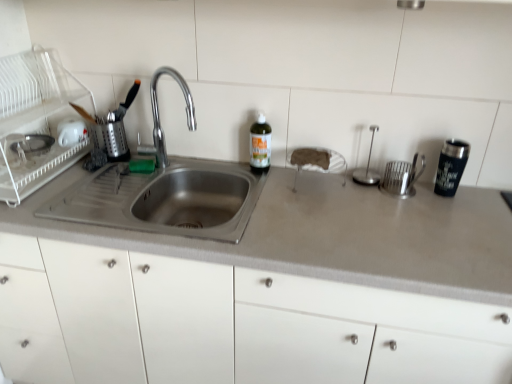
Measure the distance between point (340,169) and camera.

Point (340,169) and camera are 1.53 meters apart.

This screenshot has width=512, height=384. In order to click on white matte sponge at center, which is counted as the third appliance, starting from the left in this screenshot , I will do `click(317, 162)`.

Where is `green glass bottle at center`? green glass bottle at center is located at coordinates (260, 144).

At what (x,y) coordinates should I click in order to perform the action: click on polished stainless steel spoon holder at right, which is counted as the 4th appliance, starting from the left. Please return your answer as a coordinate pair (x, y). Looking at the image, I should click on (367, 166).

Locate an element on the screen. white matte sponge at center, which appears as the 3th appliance when viewed from the right is located at coordinates (317, 162).

From the image's perspective, is stainless steel sink at left located above or below polished stainless steel spoon holder at right, positioned as the second appliance in right-to-left order?

stainless steel sink at left is below polished stainless steel spoon holder at right, positioned as the second appliance in right-to-left order.

Find the location of a particular element. sink that appears below the polished stainless steel spoon holder at right, positioned as the second appliance in right-to-left order (from a real-world perspective) is located at coordinates (165, 191).

Would you say polished stainless steel spoon holder at right, positioned as the second appliance in right-to-left order, is part of stainless steel sink at left's contents?

No, stainless steel sink at left does not contain polished stainless steel spoon holder at right, positioned as the second appliance in right-to-left order.

Which is behind, stainless steel sink at left or polished stainless steel spoon holder at right, which is counted as the 4th appliance, starting from the left?

polished stainless steel spoon holder at right, which is counted as the 4th appliance, starting from the left, is further from the camera.

Based on the photo, considering the positions of objects green glass bottle at center and white glossy mug at upper left, placed as the 4th appliance when sorted from right to left, in the image provided, who is behind, green glass bottle at center or white glossy mug at upper left, placed as the 4th appliance when sorted from right to left,?

Positioned behind is white glossy mug at upper left, placed as the 4th appliance when sorted from right to left.

Is point (263, 154) positioned in front of point (80, 138)?

Yes, point (263, 154) is closer to viewer.

Consider the image. Is green glass bottle at center turned away from white glossy mug at upper left, the 2th appliance viewed from the left?

No, green glass bottle at center is not facing the opposite direction of white glossy mug at upper left, the 2th appliance viewed from the left.

From the image's perspective, which is above, green glass bottle at center or white glossy mug at upper left, the 2th appliance viewed from the left?

From the image's view, white glossy mug at upper left, the 2th appliance viewed from the left, is above.

The height and width of the screenshot is (384, 512). I want to click on bottle above the stainless steel sink at left (from a real-world perspective), so click(x=260, y=144).

What's the angular difference between green glass bottle at center and stainless steel sink at left's facing directions?

They differ by 0.0365 degrees in their facing directions.

Considering the points (259, 167) and (197, 225), which point is behind, point (259, 167) or point (197, 225)?

Positioned behind is point (197, 225).

Does gray matte countertop at center have a greater width compared to stainless steel sink at left?

Indeed, gray matte countertop at center has a greater width compared to stainless steel sink at left.

Is stainless steel sink at left inside gray matte countertop at center?

Yes, stainless steel sink at left can be found within gray matte countertop at center.

How far apart are gray matte countertop at center and stainless steel sink at left?

They are 9.86 inches apart.

From a real-world perspective, which object stands above the other?

white plastic dish rack at left, positioned as the 5th appliance in right-to-left order, is physically above.

Which of these two, white plastic dish rack at left, positioned as the 5th appliance in right-to-left order, or green glass bottle at center, is bigger?

Bigger between the two is white plastic dish rack at left, positioned as the 5th appliance in right-to-left order.

Looking at this image, measure the distance from white plastic dish rack at left, the 1th appliance from the left, to green glass bottle at center.

A distance of 29.61 inches exists between white plastic dish rack at left, the 1th appliance from the left, and green glass bottle at center.

In order to click on appliance that is the 2nd one above the green glass bottle at center (from a real-world perspective) in this screenshot , I will do `click(35, 121)`.

In order to click on tableware above the gray matte countertop at center (from a real-world perspective) in this screenshot , I will do `click(451, 167)`.

From a real-world perspective, is gray matte countertop at center on top of black stainless steel tumbler at right?

No.

What's the angular difference between gray matte countertop at center and black stainless steel tumbler at right's facing directions?

1.07 degrees separate the facing orientations of gray matte countertop at center and black stainless steel tumbler at right.

Is gray matte countertop at center wider than black stainless steel tumbler at right?

Correct, the width of gray matte countertop at center exceeds that of black stainless steel tumbler at right.

Which is behind, point (196, 227) or point (445, 149)?

The point (196, 227) is farther from the camera.

Identify the location of tableware behind the stainless steel sink at left. This screenshot has height=384, width=512. (451, 167).

Measure the distance between stainless steel sink at left and black stainless steel tumbler at right.

A distance of 34.13 inches exists between stainless steel sink at left and black stainless steel tumbler at right.

Is stainless steel sink at left further to camera compared to black stainless steel tumbler at right?

No, the depth of stainless steel sink at left is less than that of black stainless steel tumbler at right.

In the image, there is a polished stainless steel spoon holder at right, positioned as the second appliance in right-to-left order. In order to click on sink below it (from a real-world perspective) in this screenshot , I will do (x=165, y=191).

The image size is (512, 384). In order to click on bottle in front of the white glossy mug at upper left, placed as the 4th appliance when sorted from right to left in this screenshot , I will do `click(260, 144)`.

Based on their spatial positions, is black stainless steel tumbler at right or stainless steel sink at left further from gray matte countertop at center?

black stainless steel tumbler at right is further to gray matte countertop at center.

Looking at the image, which one is located closer to white plastic dish rack at left, the 1th appliance from the left, white glossy mug at upper left, the 2th appliance viewed from the left, or black stainless steel tumbler at right?

Among the two, white glossy mug at upper left, the 2th appliance viewed from the left, is located nearer to white plastic dish rack at left, the 1th appliance from the left.

Looking at the image, which one is located further to silver metallic utensil holder at right, positioned as the first appliance in right-to-left order, green glass bottle at center or white plastic dish rack at left, positioned as the 5th appliance in right-to-left order?

white plastic dish rack at left, positioned as the 5th appliance in right-to-left order.

Based on the photo, estimate the real-world distances between objects in this image. Which object is closer to green glass bottle at center, silver metallic utensil holder at right, positioned as the first appliance in right-to-left order, or polished stainless steel spoon holder at right, which is counted as the 4th appliance, starting from the left?

polished stainless steel spoon holder at right, which is counted as the 4th appliance, starting from the left, is closer to green glass bottle at center.

Considering their positions, is gray matte countertop at center positioned further to polished stainless steel spoon holder at right, positioned as the second appliance in right-to-left order, than silver metallic utensil holder at right, which is the 5th appliance from left to right?

The object further to polished stainless steel spoon holder at right, positioned as the second appliance in right-to-left order, is gray matte countertop at center.

Looking at the image, which one is located further to green glass bottle at center, gray matte countertop at center or polished stainless steel spoon holder at right, which is counted as the 4th appliance, starting from the left?

gray matte countertop at center lies further to green glass bottle at center than the other object.

Based on their spatial positions, is silver metallic utensil holder at right, which is the 5th appliance from left to right, or black stainless steel tumbler at right closer to green glass bottle at center?

Among the two, silver metallic utensil holder at right, which is the 5th appliance from left to right, is located nearer to green glass bottle at center.

From the picture: From the image, which object appears to be farther from polished stainless steel spoon holder at right, positioned as the second appliance in right-to-left order, green glass bottle at center or gray matte countertop at center?

Based on the image, gray matte countertop at center appears to be further to polished stainless steel spoon holder at right, positioned as the second appliance in right-to-left order.

What are the coordinates of `bottle between stainless steel sink at left and silver metallic utensil holder at right, which is the 5th appliance from left to right, from left to right` in the screenshot? It's located at (260, 144).

The image size is (512, 384). What are the coordinates of `bottle between white plastic dish rack at left, positioned as the 5th appliance in right-to-left order, and polished stainless steel spoon holder at right, which is counted as the 4th appliance, starting from the left` in the screenshot? It's located at (260, 144).

The width and height of the screenshot is (512, 384). I want to click on bottle between stainless steel sink at left and white matte sponge at center, which appears as the 3th appliance when viewed from the right, from left to right, so click(260, 144).

Where is `countertop between stainless steel sink at left and silver metallic utensil holder at right, which is the 5th appliance from left to right, in the horizontal direction`? countertop between stainless steel sink at left and silver metallic utensil holder at right, which is the 5th appliance from left to right, in the horizontal direction is located at coordinates (332, 236).